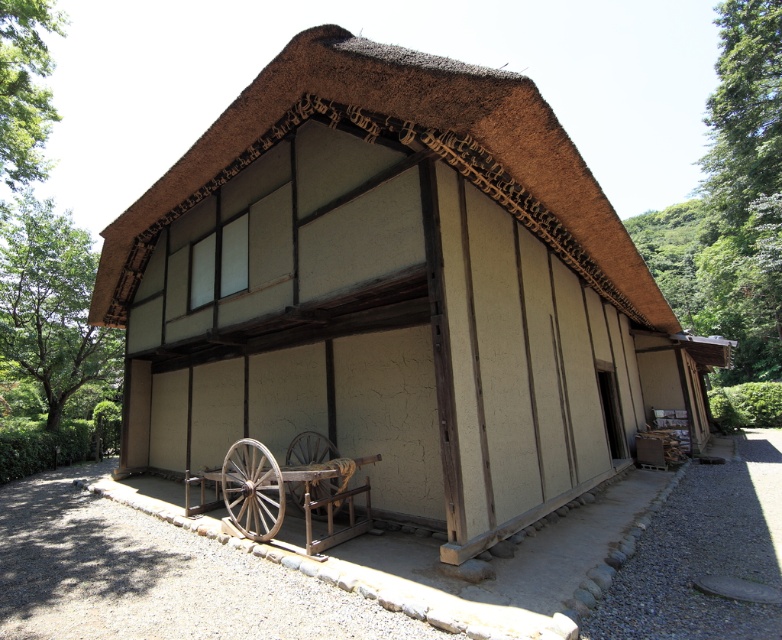
Question: Which point appears farthest from the camera in this image?

Choices:
 (A) (336, 516)
 (B) (244, 445)
 (C) (307, 464)

Answer: (C)

Question: Does beige stucco hut at center have a lesser width compared to wooden cart at center?

Choices:
 (A) no
 (B) yes

Answer: (A)

Question: Can you confirm if beige stucco hut at center is positioned above wooden at lower center?

Choices:
 (A) yes
 (B) no

Answer: (A)

Question: Which of these objects is positioned farthest from the wooden at lower center?

Choices:
 (A) wooden at lower left
 (B) beige stucco hut at center
 (C) wooden cart at center

Answer: (B)

Question: Is beige stucco hut at center bigger than wooden cart at center?

Choices:
 (A) yes
 (B) no

Answer: (A)

Question: Which point is closer to the camera?

Choices:
 (A) beige stucco hut at center
 (B) wooden at lower left
 (C) wooden cart at center

Answer: (A)